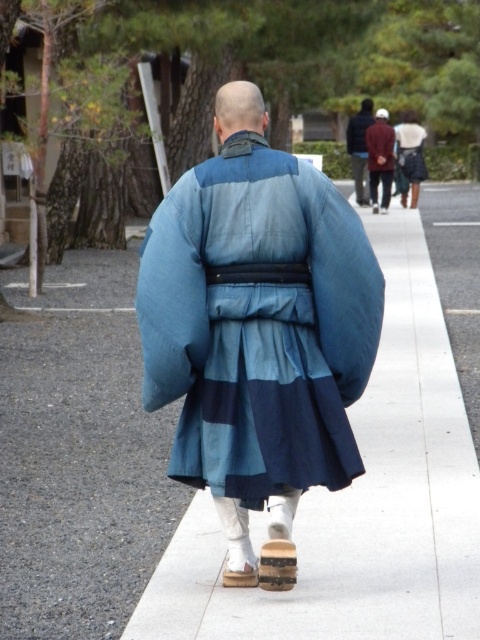
Can you confirm if blue silk kimono at center is bigger than white concrete sidewalk at center?

No, blue silk kimono at center is not bigger than white concrete sidewalk at center.

Who is taller, blue silk kimono at center or white concrete sidewalk at center?

With more height is white concrete sidewalk at center.

Which is in front, point (319, 280) or point (81, 458)?

Point (319, 280) is in front.

In order to click on blue silk kimono at center in this screenshot , I will do `click(257, 332)`.

Measure the distance from white concrete sidewalk at center to dark blue fabric bag at upper center.

The distance of white concrete sidewalk at center from dark blue fabric bag at upper center is 12.42 meters.

Is white concrete sidewalk at center bigger than dark blue fabric bag at upper center?

Yes, white concrete sidewalk at center is bigger than dark blue fabric bag at upper center.

Does point (38, 410) come behind point (358, 193)?

No, (38, 410) is closer to viewer.

The width and height of the screenshot is (480, 640). I want to click on white concrete sidewalk at center, so click(79, 456).

The height and width of the screenshot is (640, 480). What do you see at coordinates (257, 332) in the screenshot? I see `blue silk kimono at center` at bounding box center [257, 332].

Who is lower down, blue silk kimono at center or dark blue fabric bag at upper center?

blue silk kimono at center is lower down.

Is point (280, 352) farther from viewer compared to point (365, 204)?

No.

Locate an element on the screen. Image resolution: width=480 pixels, height=640 pixels. blue silk kimono at center is located at coordinates (257, 332).